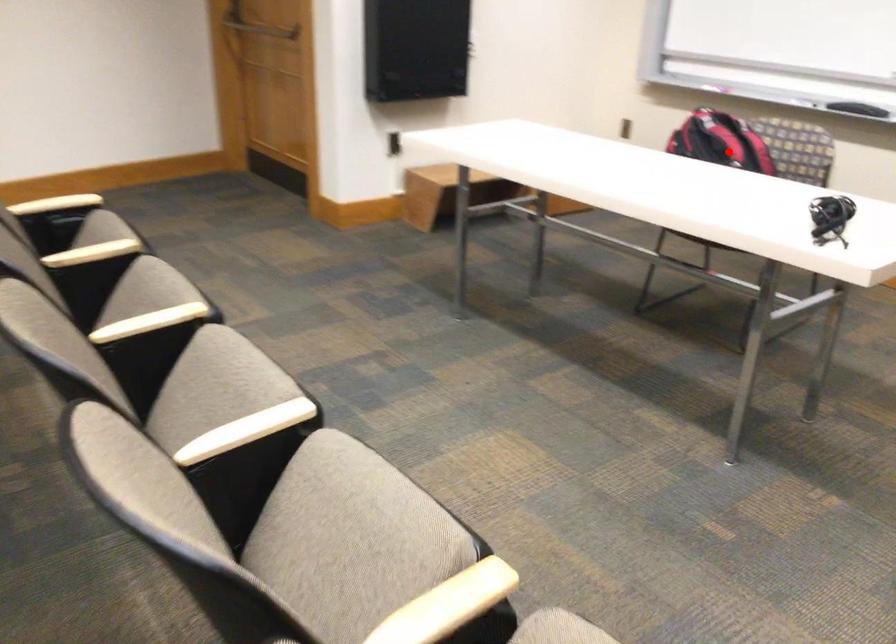
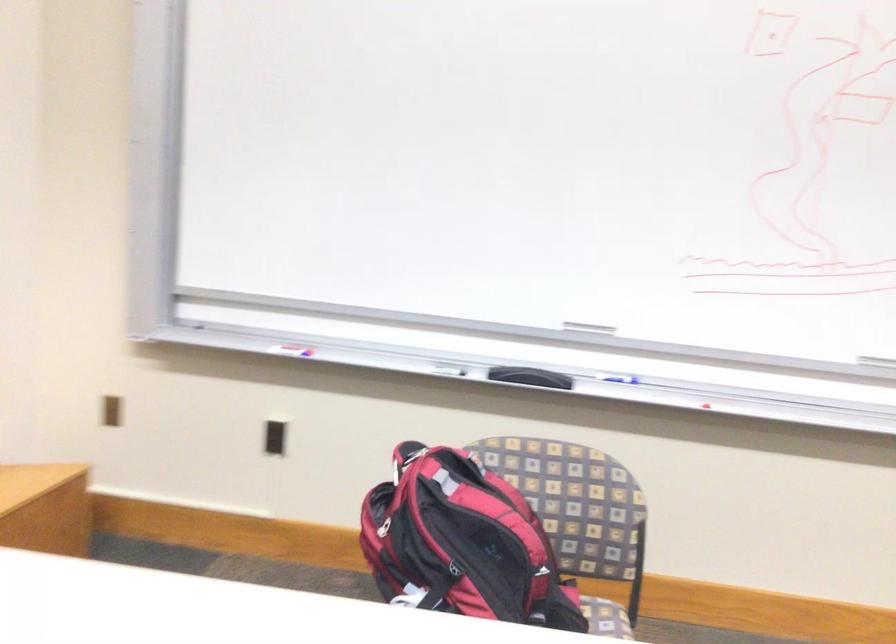
Question: I am providing you with two images of the same scene from different viewpoints. Image1 has a red point marked. In image2, the corresponding 3D location appears at what relative position? Reply with the corresponding letter.

Choices:
 (A) Closer
 (B) Farther

Answer: (A)